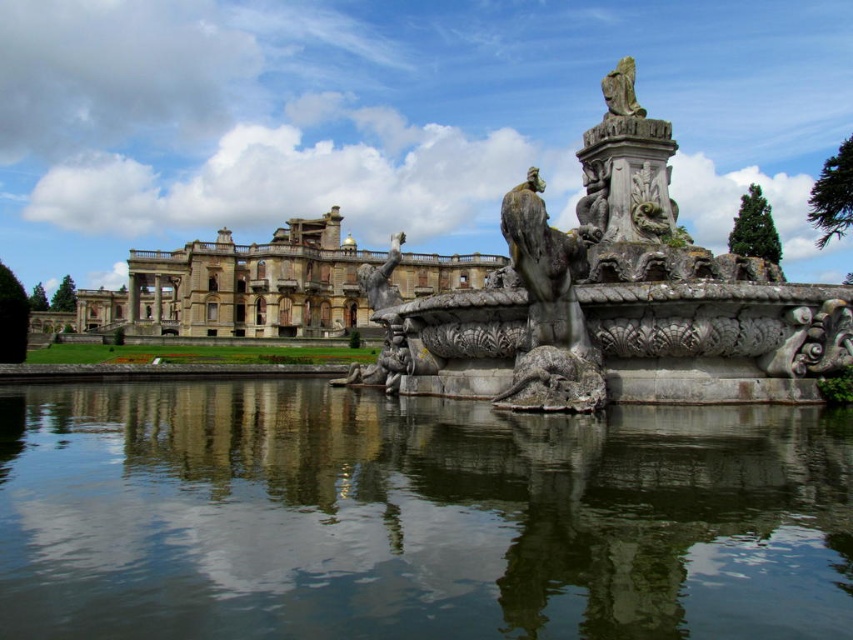
Is the position of beige stone palace at center more distant than that of gray stone dragon at center?

Yes, it is behind gray stone dragon at center.

Can you confirm if beige stone palace at center is positioned below gray stone dragon at center?

Actually, beige stone palace at center is above gray stone dragon at center.

Measure the distance between beige stone palace at center and camera.

beige stone palace at center and camera are 486.24 feet apart from each other.

Identify the location of beige stone palace at center. (239, 285).

Is point (776, 636) positioned behind point (799, 371)?

No, (776, 636) is in front of (799, 371).

Based on the photo, which of these two, transparent glass water at center or gray stone fountain at center, stands taller?

With more height is gray stone fountain at center.

Who is more forward, (71,403) or (663,205)?

Point (71,403)

Locate an element on the screen. transparent glass water at center is located at coordinates click(x=415, y=516).

Which is in front, point (163, 480) or point (547, 387)?

Point (163, 480) is more forward.

Is transparent glass water at center above gray stone dragon at center?

Incorrect, transparent glass water at center is not positioned above gray stone dragon at center.

Is point (44, 448) positioned in front of point (544, 216)?

Yes, point (44, 448) is closer to viewer.

You are a GUI agent. You are given a task and a screenshot of the screen. Output one action in this format:
    pyautogui.click(x=<x>, y=<y>)
    Task: Click on the transparent glass water at center
    
    Given the screenshot: What is the action you would take?
    pyautogui.click(x=415, y=516)